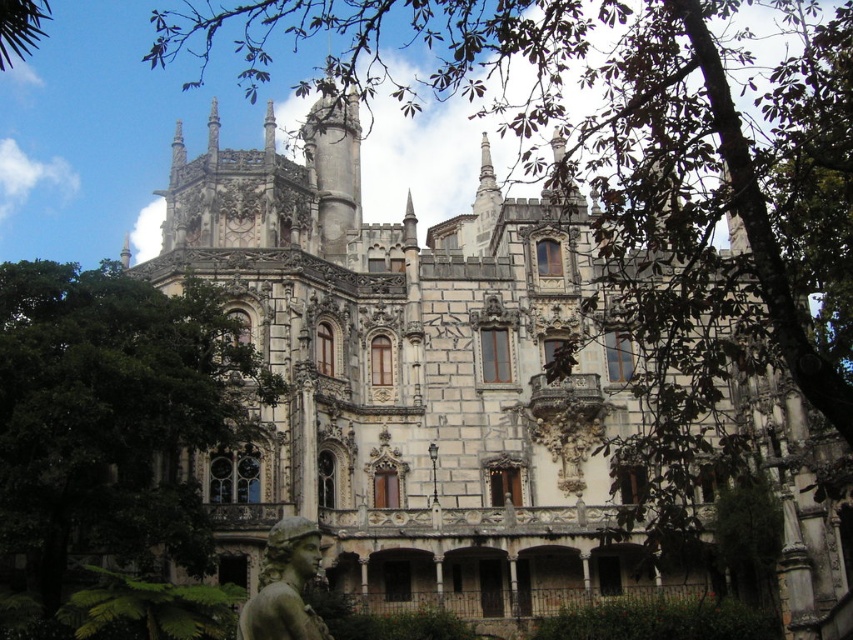
You are standing in front of the grand Gothic Revival building and want to take a photo of both the green leafy tree at center and the green marble statue at lower center. Which object should you position to the right side of your camera frame to include both in the shot?

You should position the green marble statue at lower center to the right side of your camera frame because the green leafy tree at center is to the left of it, so placing the statue on the right will ensure both are included in the shot.

From the picture: Based on the scene description, where is the green leafy tree at center positioned in relation to the grand building?

The green leafy tree at center is located at point 0.650 on the x axis and 0.134 on the y axis relative to the grand building.

You are a landscape architect planning to place a new bench in the garden. The bench requires a space wider than the green marble statue at lower center. Can the space occupied by the green leafy tree at center accommodate the bench?

The green leafy tree at center is wider than the green marble statue at lower center. Since the bench requires a space wider than the statue, the space occupied by the green leafy tree at center can accommodate the bench.